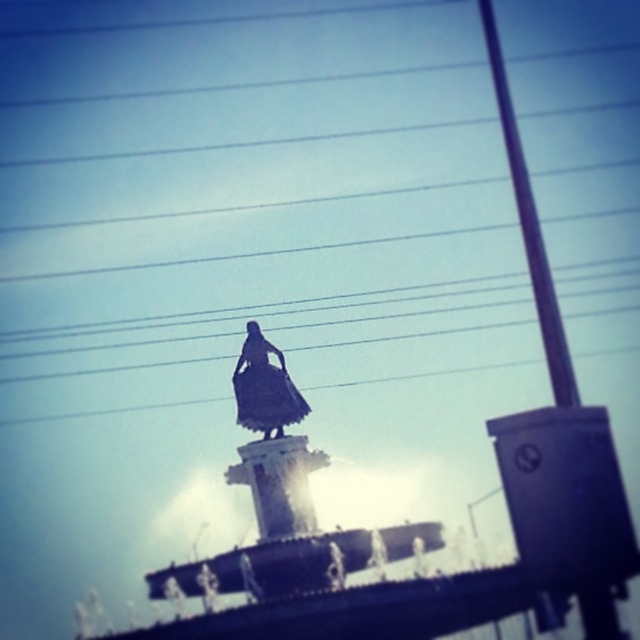
You are a city planner reviewing the layout of a public square. You notice the metallic pole at right and the black matte dress at center in the image. Based on their sizes, which object would be more suitable for installing a public information board?

The metallic pole at right is larger in size than the black matte dress at center, making it more suitable for installing a public information board since it can support the board better.

You are standing at the center of the image and want to locate the metallic pole at right. According to the coordinates provided, in which direction should you look to find it?

The metallic pole at right is located at coordinates point (531, 228), so you should look to the right side of the image to find it.